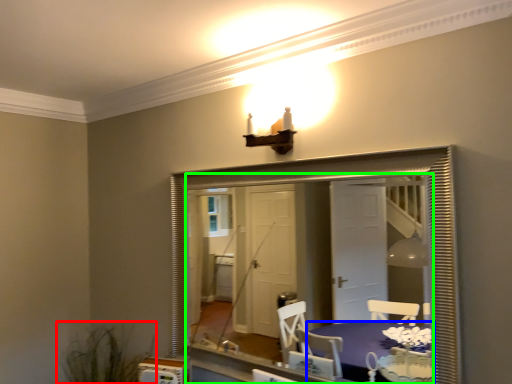
Question: Which object is the closest to the plant (highlighted by a red box)? Choose among these: table (highlighted by a blue box) or mirror (highlighted by a green box).

Choices:
 (A) table
 (B) mirror

Answer: (A)